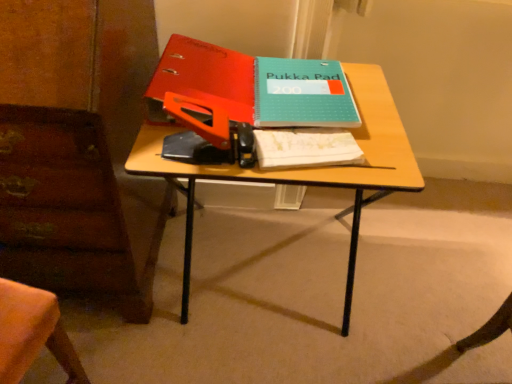
The image size is (512, 384). Identify the location of free region under wooden desk at center (from a real-world perspective). (256, 280).